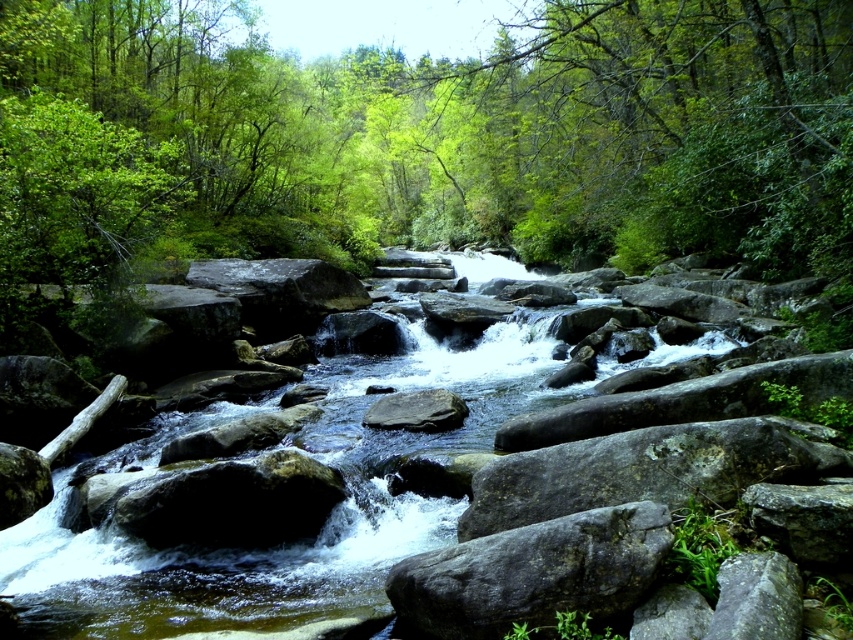
You are a hiker standing at the edge of the stream and want to cross to the other side. You notice two rocks in the middle of the stream that you could step on. The rocks are labeled as gray mossy rock at center and gray rough rock at center. Which rock should you step on first to safely cross the stream?

You should step on the gray mossy rock at center first because the gray rough rock at center is behind it, making the mossy rock the closer one to your current position.

You are a hiker planning to cross the stream in the image. You see two rocks in the center of the stream, the gray mossy rock at center and the gray rough rock at center. Which rock would provide a more stable footing for crossing?

The gray mossy rock at center is bigger than the gray rough rock at center, so it would provide a more stable footing for crossing the stream.